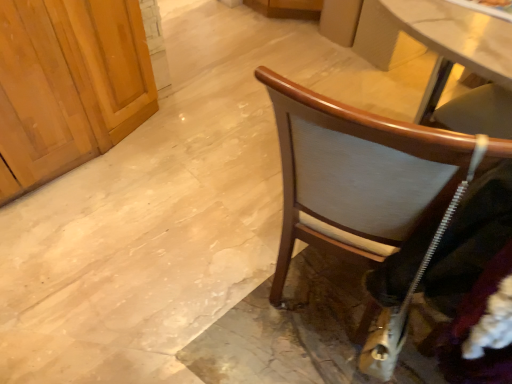
In order to click on blank area beneath wooden chair at right (from a real-world perspective) in this screenshot , I will do `click(316, 282)`.